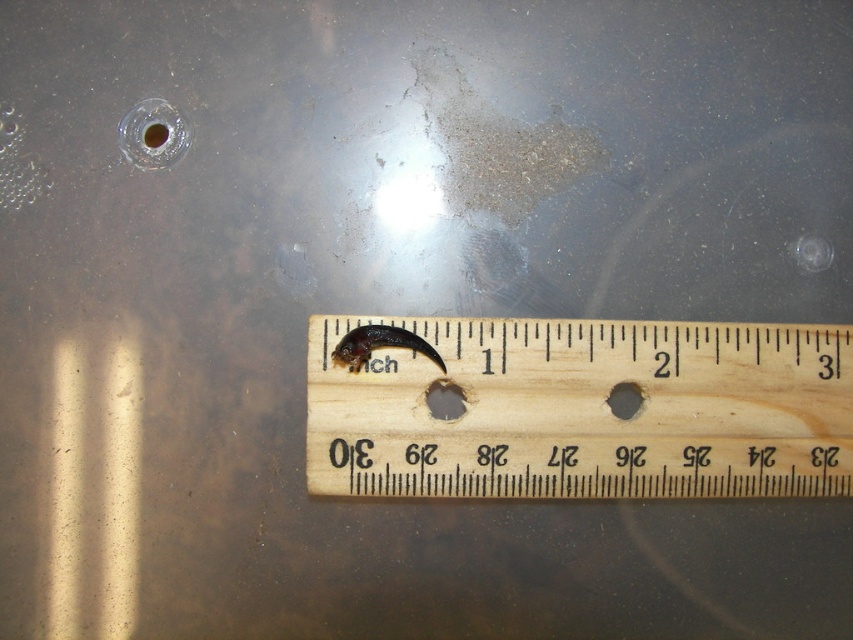
You are standing in front of a ruler with a small dark object on it. The ruler is placed horizontally against a plastic surface. You want to know how far you are from the point marked as point (444, 396) on the ruler. Can you determine the distance?

The distance between point (444, 396) and the viewer is 4.19 feet.

You have two holes in front of you, a matte plastic hole at center and a matte black hole at center. Which one is bigger?

The matte plastic hole at center is larger in size compared to the matte black hole at center.

You are a scientist observing the image. You need to place a sample in the matte plastic hole at center and the matte black hole at center. Which hole should you place the sample closer to the left side of the ruler?

The matte plastic hole at center is positioned on the left side of the matte black hole at center, so you should place the sample closer to the left side of the ruler in the matte plastic hole at center.